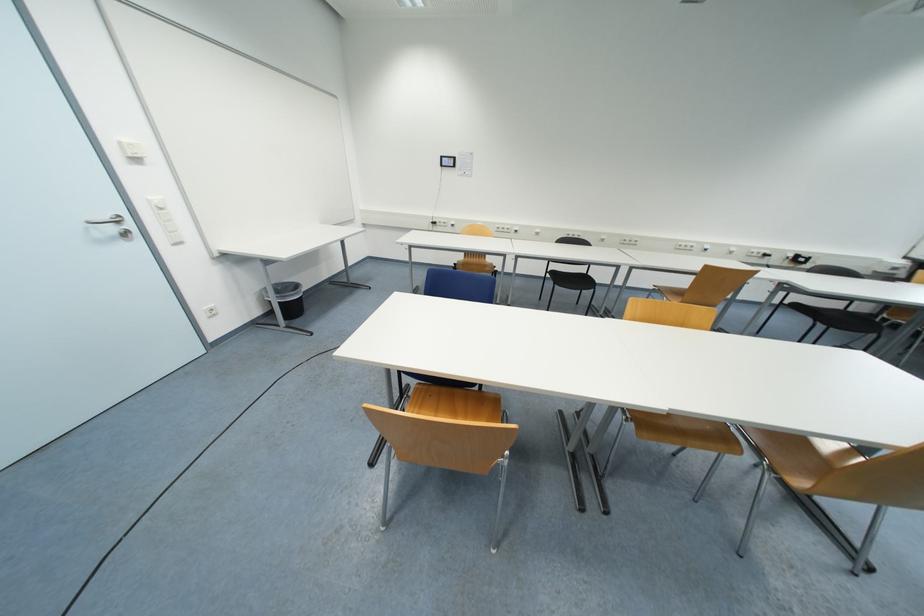
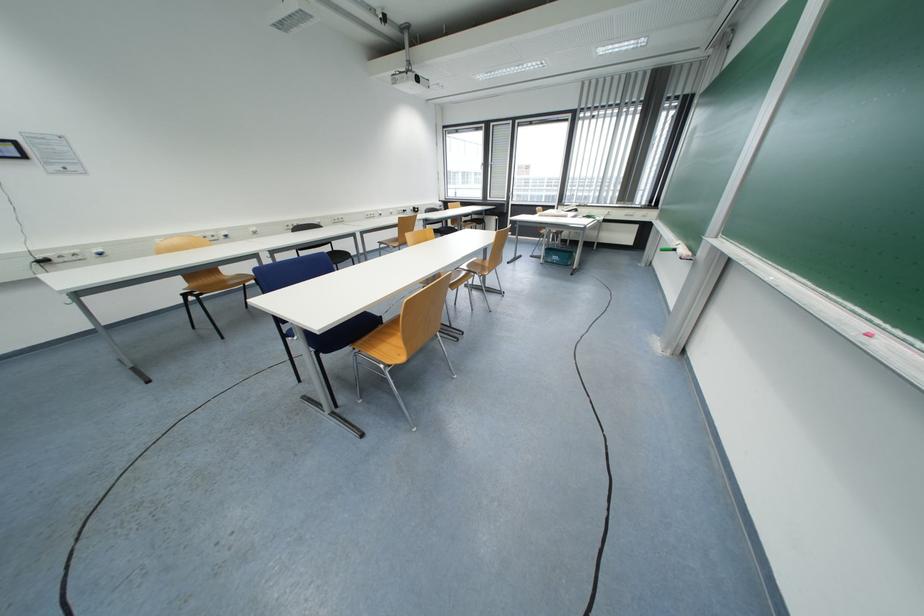
Locate, in the second image, the point that corresponds to (466,259) in the first image.

(186, 286)